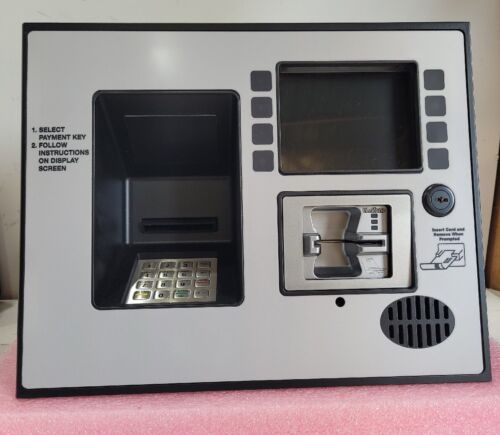
This screenshot has height=435, width=500. In order to click on screen in this screenshot , I will do `click(392, 94)`.